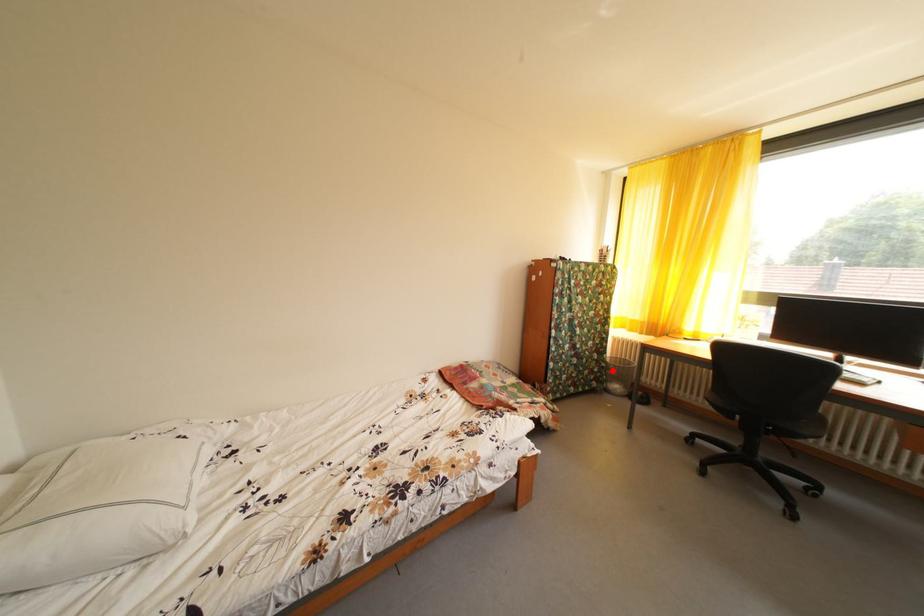
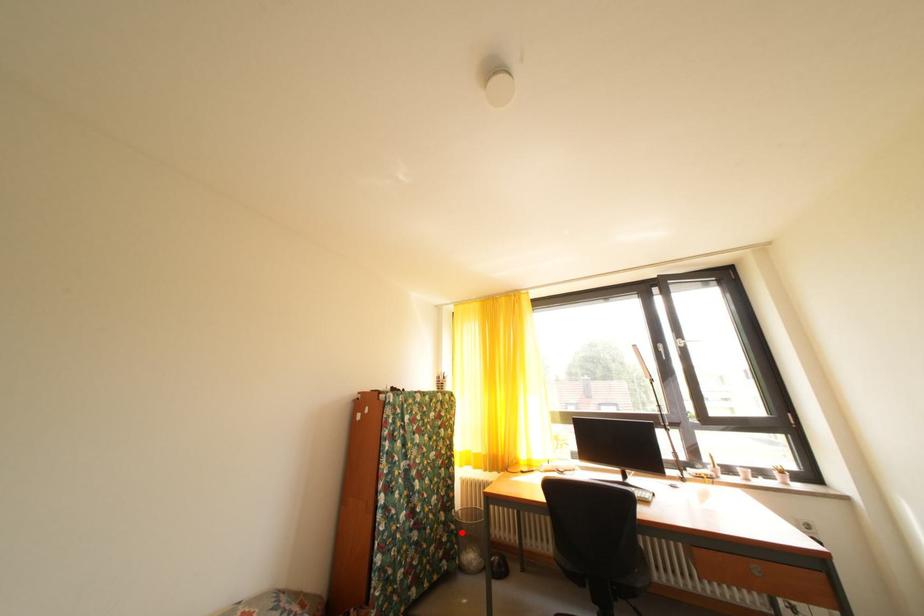
I am providing you with two images of the same scene from different viewpoints. A red point is marked on the first image and another point is marked on the second image. Do the highlighted points in image1 and image2 indicate the same real-world spot?

Yes